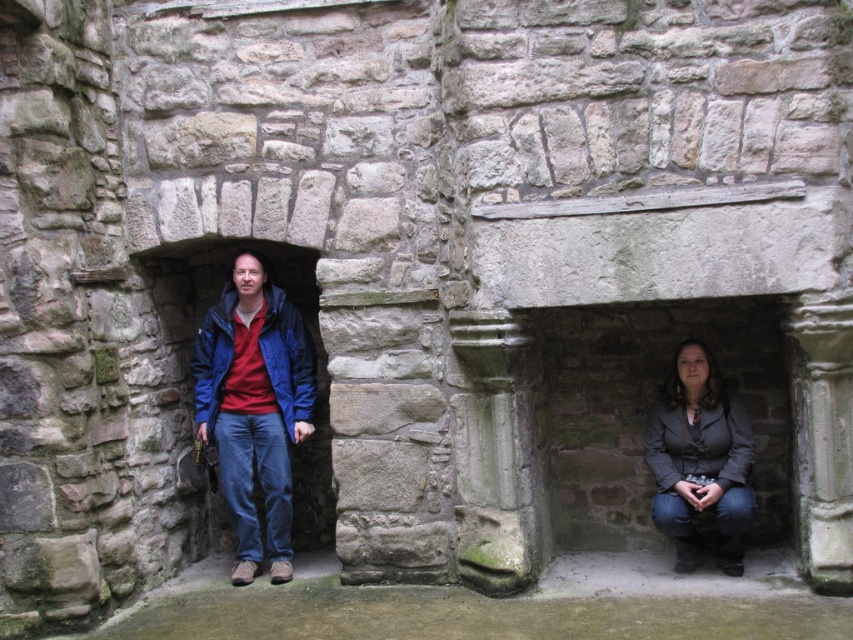
You are a photographer trying to capture both the dark gray textured jacket at lower right and the dark gray matte jacket at lower right in a single shot. Based on their positions, which jacket is closer to the camera?

The dark gray textured jacket at lower right is located below the dark gray matte jacket at lower right, so the dark gray matte jacket at lower right is closer to the camera.

You are a tour guide leading a group through these ruins. You need to move from the dark gray textured jacket at lower right to the blue fabric jacket at center. Is there enough space for you to walk directly between them?

The distance between the dark gray textured jacket at lower right and the blue fabric jacket at center is 2.12 meters, so yes, there is enough space to walk directly between them since the distance is sufficient for a person to pass through comfortably.

You are a photographer planning to take a group photo of the two people wearing the blue fabric jacket at center and the dark gray matte jacket at lower right. The camera you are using has a maximum focus range of 2 meters. Can you capture both individuals in focus without moving either of them?

The blue fabric jacket at center and the dark gray matte jacket at lower right are 2.10 meters apart. Since the camera has a maximum focus range of 2 meters, the distance between them exceeds this limit. Therefore, you cannot capture both in focus without adjusting their positions.